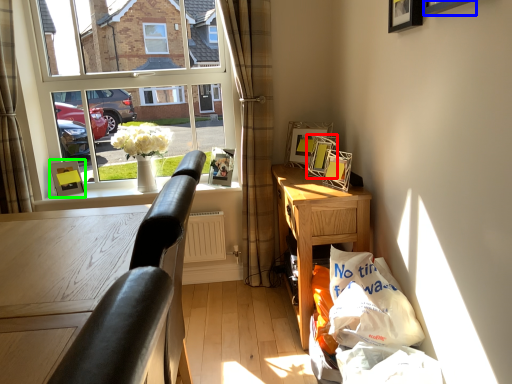
Question: Based on their relative distances, which object is nearer to picture frame (highlighted by a red box)? Choose from picture frame (highlighted by a blue box) and picture frame (highlighted by a green box).

Choices:
 (A) picture frame
 (B) picture frame

Answer: (A)